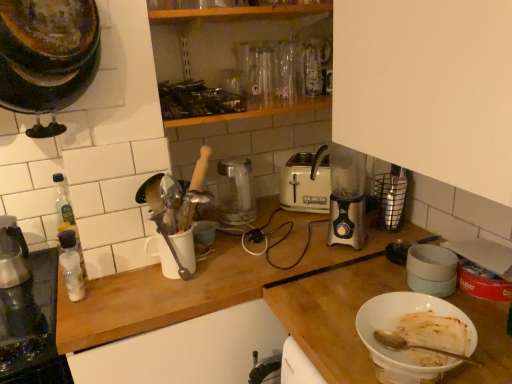
Question: Is rusty metal pot at upper left, acting as the 1th kitchen appliance starting from the front, closer to the viewer compared to metallic glass carafe at left?

Choices:
 (A) yes
 (B) no

Answer: (A)

Question: From the image's perspective, is rusty metal pot at upper left, acting as the 1th kitchen appliance starting from the front, on top of metallic glass carafe at left?

Choices:
 (A) yes
 (B) no

Answer: (A)

Question: Can you confirm if rusty metal pot at upper left, positioned as the third kitchen appliance in right-to-left order, is taller than metallic glass carafe at left?

Choices:
 (A) yes
 (B) no

Answer: (A)

Question: Is rusty metal pot at upper left, acting as the 1th kitchen appliance starting from the front, thinner than metallic glass carafe at left?

Choices:
 (A) no
 (B) yes

Answer: (B)

Question: Is rusty metal pot at upper left, acting as the 3th kitchen appliance starting from the back, not within metallic glass carafe at left?

Choices:
 (A) yes
 (B) no

Answer: (A)

Question: From the image's perspective, is satin silver blender at right, the first appliance viewed from the right, located above or below silver metallic blender at center, the 3th kitchen appliance viewed from the left?

Choices:
 (A) above
 (B) below

Answer: (B)

Question: From a real-world perspective, is satin silver blender at right, the first appliance viewed from the right, positioned above or below silver metallic blender at center, arranged as the 2th kitchen appliance when viewed from the front?

Choices:
 (A) above
 (B) below

Answer: (B)

Question: In terms of size, does satin silver blender at right, the first appliance viewed from the right, appear bigger or smaller than silver metallic blender at center, which appears as the 1th kitchen appliance when viewed from the right?

Choices:
 (A) big
 (B) small

Answer: (B)

Question: Is satin silver blender at right, which appears as the second appliance when viewed from the left, inside or outside of silver metallic blender at center, the second kitchen appliance from the back?

Choices:
 (A) outside
 (B) inside

Answer: (A)

Question: Which is correct: silver metallic blender at center, the second kitchen appliance from the back, is inside white matte bowl at lower right, acting as the second bowl starting from the top, or outside of it?

Choices:
 (A) outside
 (B) inside

Answer: (A)

Question: Does point (334, 240) appear closer or farther from the camera than point (449, 349)?

Choices:
 (A) farther
 (B) closer

Answer: (A)

Question: Considering the relative positions of silver metallic blender at center, the second kitchen appliance from the back, and white matte bowl at lower right, the first bowl in the front-to-back sequence, in the image provided, is silver metallic blender at center, the second kitchen appliance from the back, to the left or to the right of white matte bowl at lower right, the first bowl in the front-to-back sequence,?

Choices:
 (A) right
 (B) left

Answer: (B)

Question: From the image's perspective, is silver metallic blender at center, the 3th kitchen appliance viewed from the left, located above or below white matte bowl at lower right, the 2th bowl from the left?

Choices:
 (A) above
 (B) below

Answer: (A)

Question: Would you say metallic glass carafe at left is inside or outside white plastic toaster at center?

Choices:
 (A) outside
 (B) inside

Answer: (A)

Question: Is metallic glass carafe at left to the left or to the right of white plastic toaster at center in the image?

Choices:
 (A) left
 (B) right

Answer: (A)